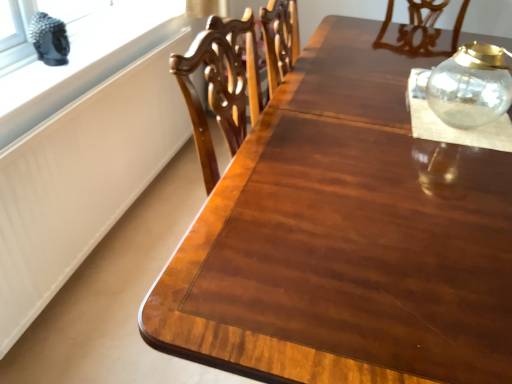
Question: Does white matte window sill at upper left have a greater height compared to transparent glass jar at upper right?

Choices:
 (A) yes
 (B) no

Answer: (B)

Question: Is white matte window sill at upper left bigger than transparent glass jar at upper right?

Choices:
 (A) no
 (B) yes

Answer: (A)

Question: Can you confirm if white matte window sill at upper left is smaller than transparent glass jar at upper right?

Choices:
 (A) yes
 (B) no

Answer: (A)

Question: Can you confirm if white matte window sill at upper left is shorter than transparent glass jar at upper right?

Choices:
 (A) no
 (B) yes

Answer: (B)

Question: From a real-world perspective, is white matte window sill at upper left over transparent glass jar at upper right?

Choices:
 (A) no
 (B) yes

Answer: (B)

Question: From the image's perspective, is white matte window sill at upper left under transparent glass jar at upper right?

Choices:
 (A) no
 (B) yes

Answer: (B)

Question: Does transparent glass jar at upper right lie behind white matte window sill at upper left?

Choices:
 (A) yes
 (B) no

Answer: (B)

Question: Would you say transparent glass jar at upper right is outside white matte window sill at upper left?

Choices:
 (A) yes
 (B) no

Answer: (A)

Question: Is transparent glass jar at upper right shorter than white matte window sill at upper left?

Choices:
 (A) no
 (B) yes

Answer: (A)

Question: Considering the relative sizes of transparent glass jar at upper right and white matte window sill at upper left in the image provided, is transparent glass jar at upper right wider than white matte window sill at upper left?

Choices:
 (A) yes
 (B) no

Answer: (A)

Question: Considering the relative positions of transparent glass jar at upper right and white matte window sill at upper left in the image provided, is transparent glass jar at upper right to the right of white matte window sill at upper left from the viewer's perspective?

Choices:
 (A) no
 (B) yes

Answer: (B)

Question: Is transparent glass jar at upper right oriented away from white matte window sill at upper left?

Choices:
 (A) no
 (B) yes

Answer: (B)

Question: Can transparent glass jar at upper right be found inside transparent glass jar at upper right?

Choices:
 (A) yes
 (B) no

Answer: (B)